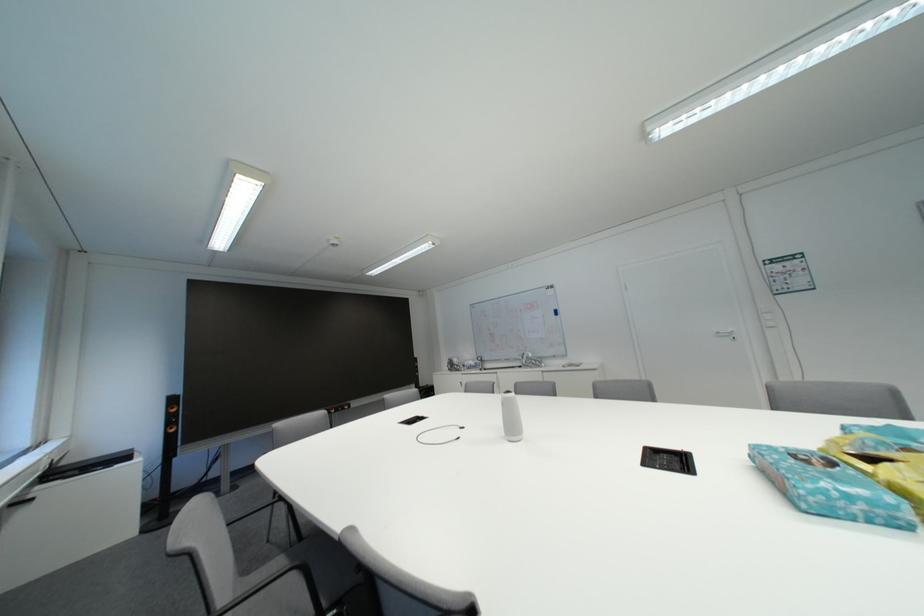
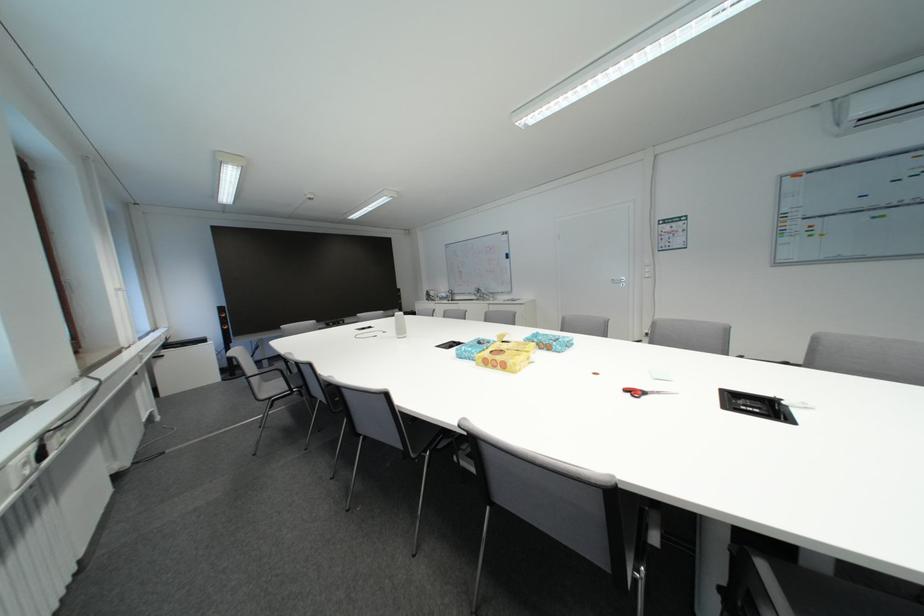
Locate, in the second image, the point that corresponds to pixel 245 490 in the first image.

(282, 368)